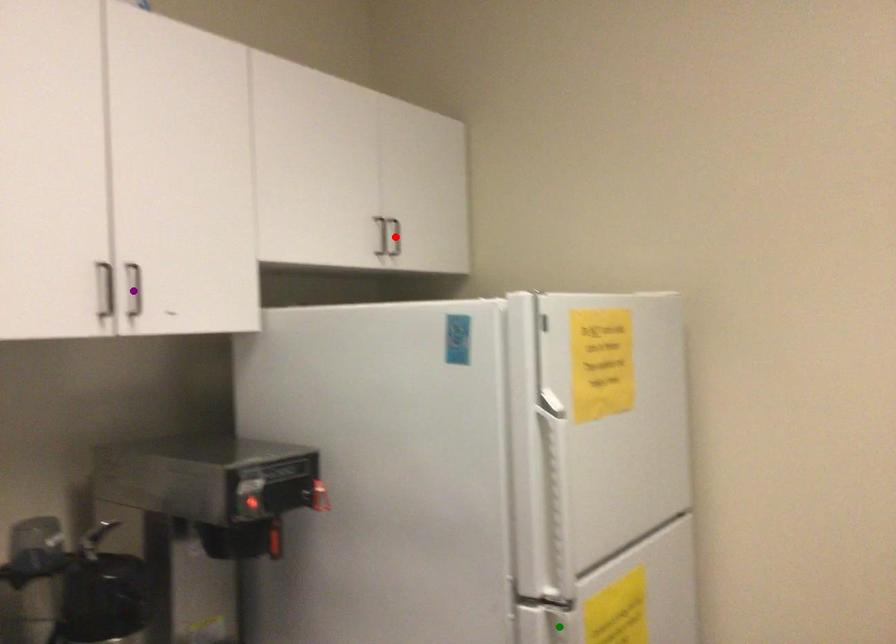
From the picture: Order these from nearest to farthest:
1. red point
2. purple point
3. green point

green point
purple point
red point